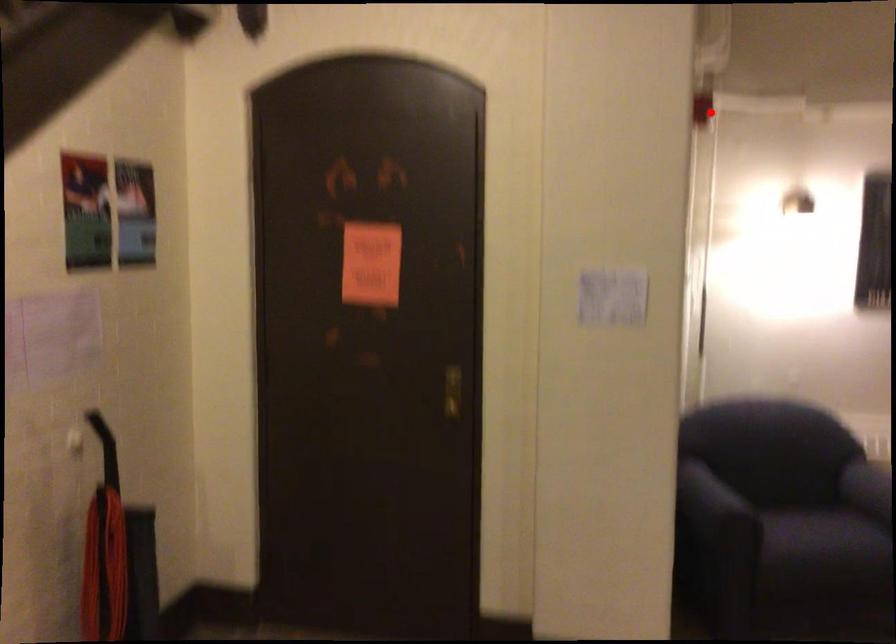
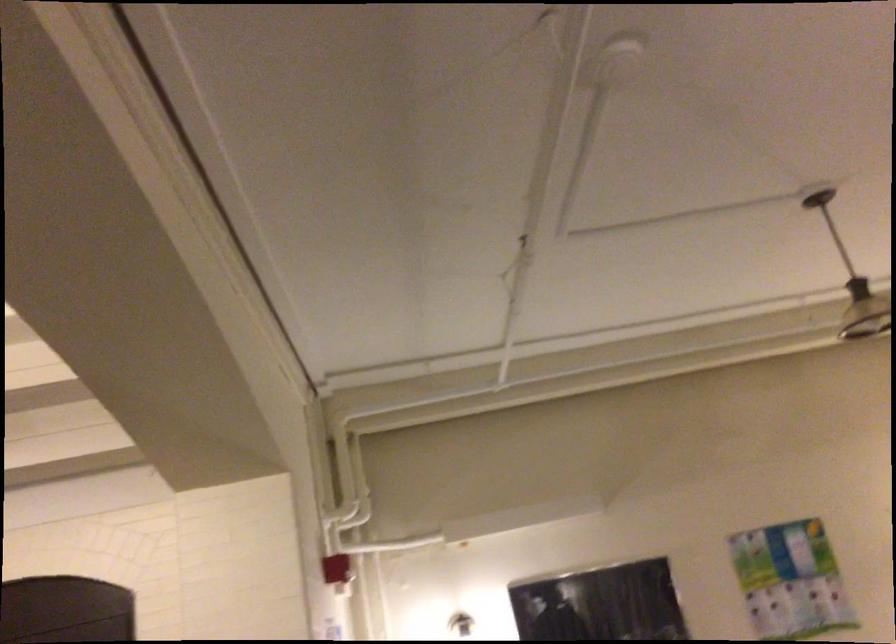
Find the pixel in the second image that matches the highlighted location in the first image.

(337, 569)